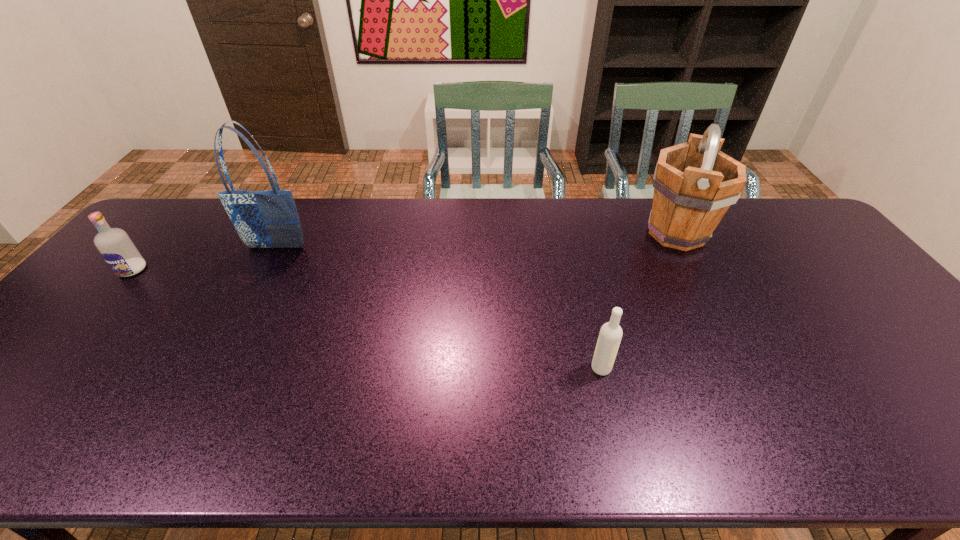
You are a GUI agent. You are given a task and a screenshot of the screen. Output one action in this format:
    pyautogui.click(x=<x>, y=<y>)
    Task: Click on the object at the far edge
    
    Given the screenshot: What is the action you would take?
    pyautogui.click(x=694, y=184)

Identify the location of object situated at the left edge. Image resolution: width=960 pixels, height=540 pixels. (115, 246).

You are a GUI agent. You are given a task and a screenshot of the screen. Output one action in this format:
    pyautogui.click(x=<x>, y=<y>)
    Task: Click on the vacant space at the far edge of the desktop
    
    Given the screenshot: What is the action you would take?
    pyautogui.click(x=613, y=229)

Find the location of a particular element. Image resolution: width=960 pixels, height=540 pixels. free spot at the near edge of the desktop is located at coordinates (202, 424).

Identify the location of free location at the left edge. (122, 313).

What are the coordinates of `vacant point at the right edge` in the screenshot? It's located at (814, 259).

Where is `vacant space at the far left corner of the desktop`? vacant space at the far left corner of the desktop is located at coordinates (136, 235).

I want to click on free space at the far right corner, so click(x=761, y=222).

Where is `free spot between the leftmost object and the rightmost object`? The image size is (960, 540). free spot between the leftmost object and the rightmost object is located at coordinates (404, 252).

In order to click on empty location between the shopping bag and the bucket in this screenshot , I will do `click(476, 240)`.